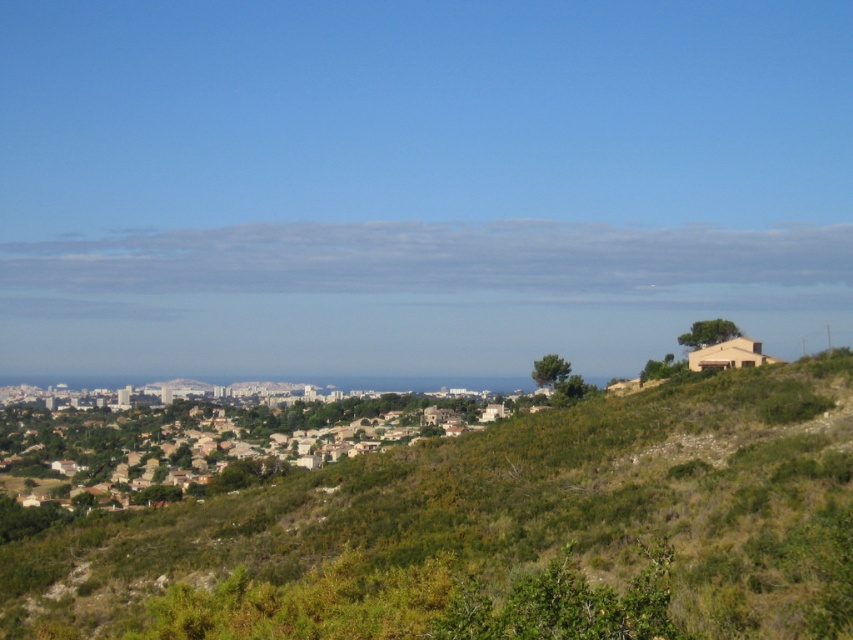
Question: Which object appears closest to the camera in this image?

Choices:
 (A) brown stone houses at lower left
 (B) beige matte house at right

Answer: (A)

Question: Is green shrubbery at center above brown stone houses at lower left?

Choices:
 (A) no
 (B) yes

Answer: (B)

Question: Which point is closer to the camera?

Choices:
 (A) green shrubbery at center
 (B) brown stone houses at lower left
 (C) beige matte house at right

Answer: (A)

Question: Which is nearer to the green shrubbery at center?

Choices:
 (A) beige matte house at right
 (B) brown stone houses at lower left

Answer: (A)

Question: Is brown stone houses at lower left behind beige matte house at right?

Choices:
 (A) yes
 (B) no

Answer: (B)

Question: Is brown stone houses at lower left above beige matte house at right?

Choices:
 (A) no
 (B) yes

Answer: (A)